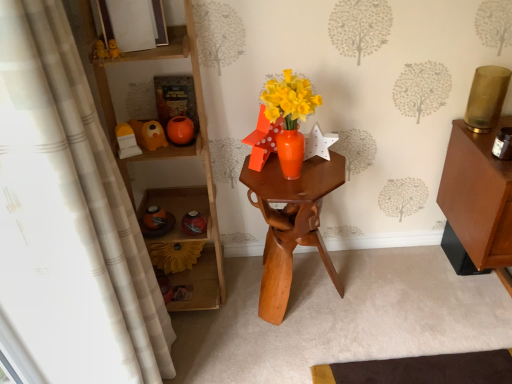
Locate an element on the screen. This screenshot has height=384, width=512. free space that is in between white textured curtain at left and wooden shelf at left is located at coordinates (206, 343).